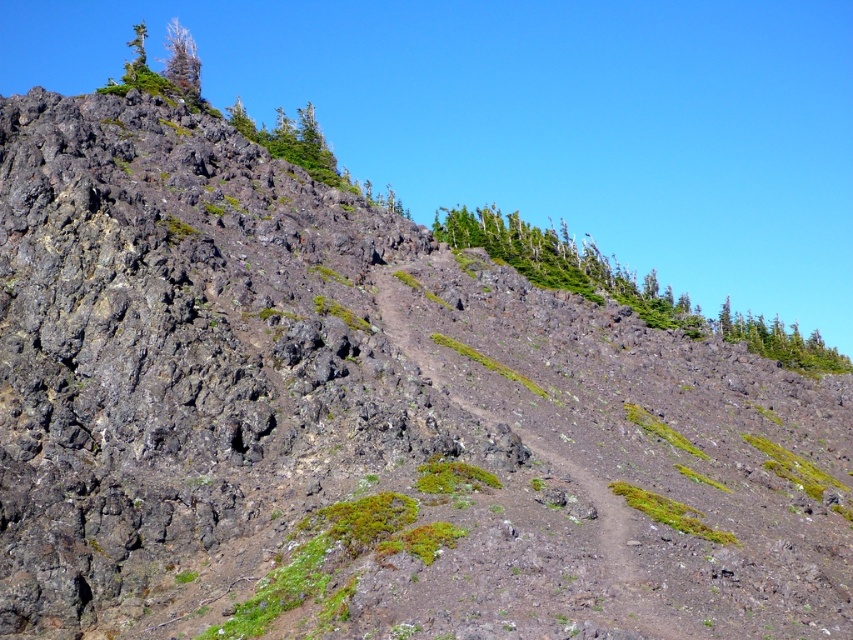
Image resolution: width=853 pixels, height=640 pixels. What do you see at coordinates (622, 285) in the screenshot? I see `green leafy trees at upper right` at bounding box center [622, 285].

Which is more to the left, green leafy trees at upper right or green leafy tree at upper left?

From the viewer's perspective, green leafy tree at upper left appears more on the left side.

Which is behind, point (469, 211) or point (141, 24)?

Positioned behind is point (141, 24).

This screenshot has width=853, height=640. What are the coordinates of `green leafy trees at upper right` in the screenshot? It's located at (622, 285).

Between green leafy trees at upper right and green mossy tree at upper left, which one has less height?

Standing shorter between the two is green leafy trees at upper right.

Is green leafy trees at upper right positioned behind green mossy tree at upper left?

That is False.

Describe the element at coordinates (622, 285) in the screenshot. The height and width of the screenshot is (640, 853). I see `green leafy trees at upper right` at that location.

You are a GUI agent. You are given a task and a screenshot of the screen. Output one action in this format:
    pyautogui.click(x=<x>, y=<y>)
    Task: Click on the green leafy trees at upper right
    The width and height of the screenshot is (853, 640).
    Given the screenshot: What is the action you would take?
    pyautogui.click(x=622, y=285)

Is point (170, 77) farther from viewer compared to point (140, 56)?

Yes, it is behind point (140, 56).

Does point (199, 90) come farther from viewer compared to point (140, 61)?

Yes, it is behind point (140, 61).

Locate an element on the screen. The width and height of the screenshot is (853, 640). green mossy tree at upper left is located at coordinates tap(181, 60).